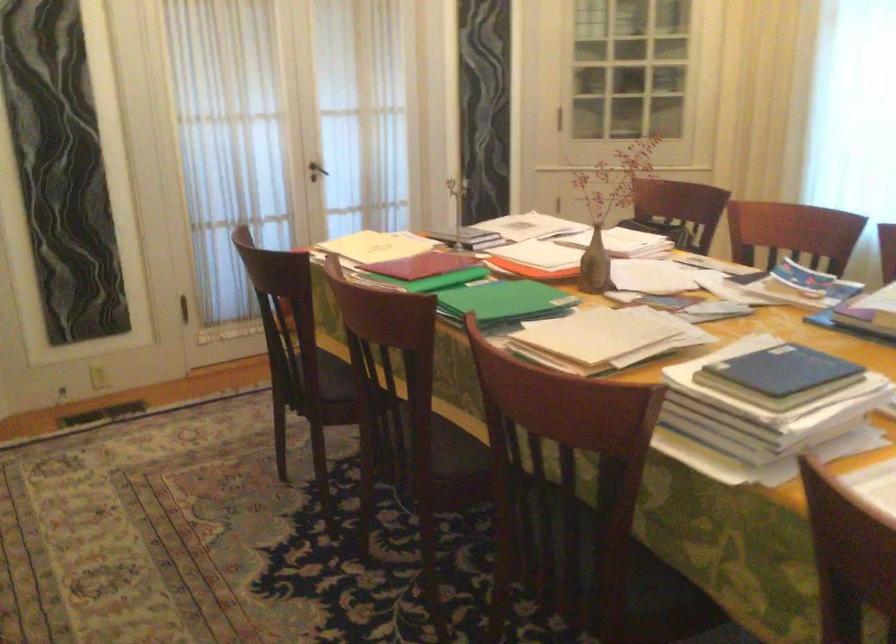
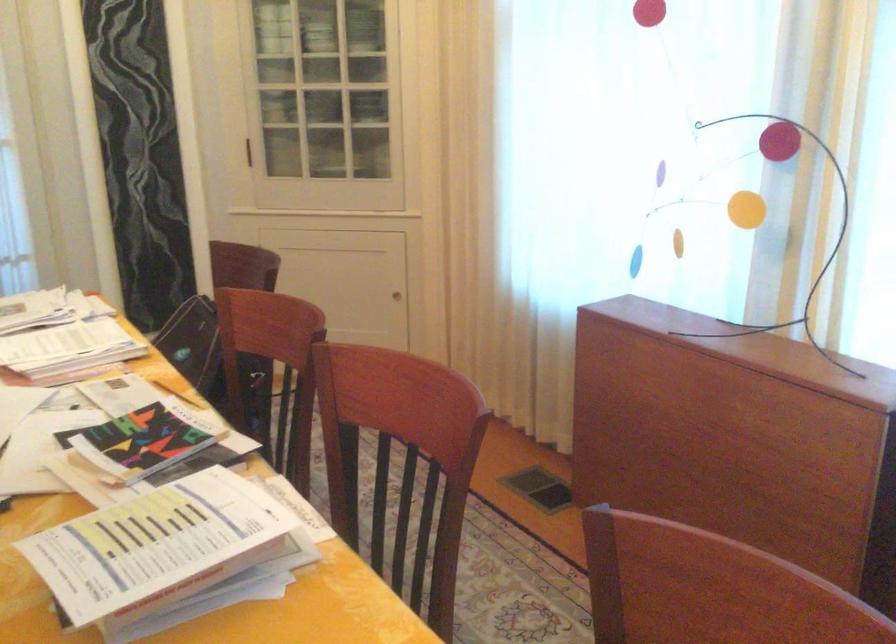
The images are taken continuously from a first-person perspective. In which direction are you moving?

The cameraman walked toward right, forward.